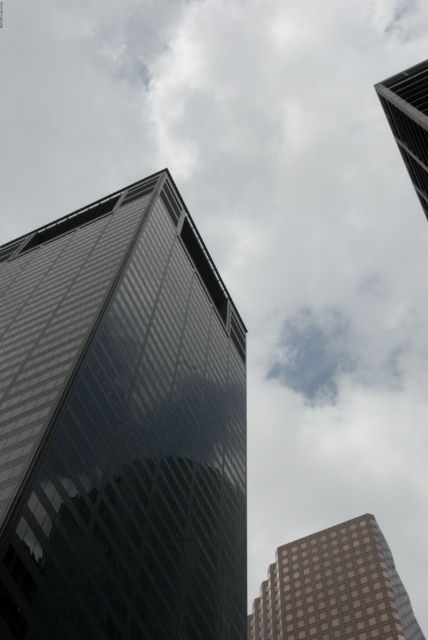
Question: Among these points, which one is nearest to the camera?

Choices:
 (A) (166, 189)
 (B) (412, 163)
 (C) (389, 589)

Answer: (B)

Question: Is shiny glass tower at center to the left of glassy reflective skyscraper at upper right from the viewer's perspective?

Choices:
 (A) yes
 (B) no

Answer: (A)

Question: Where is shiny glass tower at center located in relation to glassy reflective skyscraper at upper right in the image?

Choices:
 (A) right
 (B) left

Answer: (B)

Question: Which is farther from the brown grid-patterned building at lower right?

Choices:
 (A) glassy reflective skyscraper at upper right
 (B) shiny glass tower at center

Answer: (A)

Question: Which point appears closest to the camera in this image?

Choices:
 (A) (297, 630)
 (B) (9, 321)
 (C) (410, 104)

Answer: (B)

Question: Can you confirm if shiny glass tower at center is smaller than brown grid-patterned building at lower right?

Choices:
 (A) no
 (B) yes

Answer: (A)